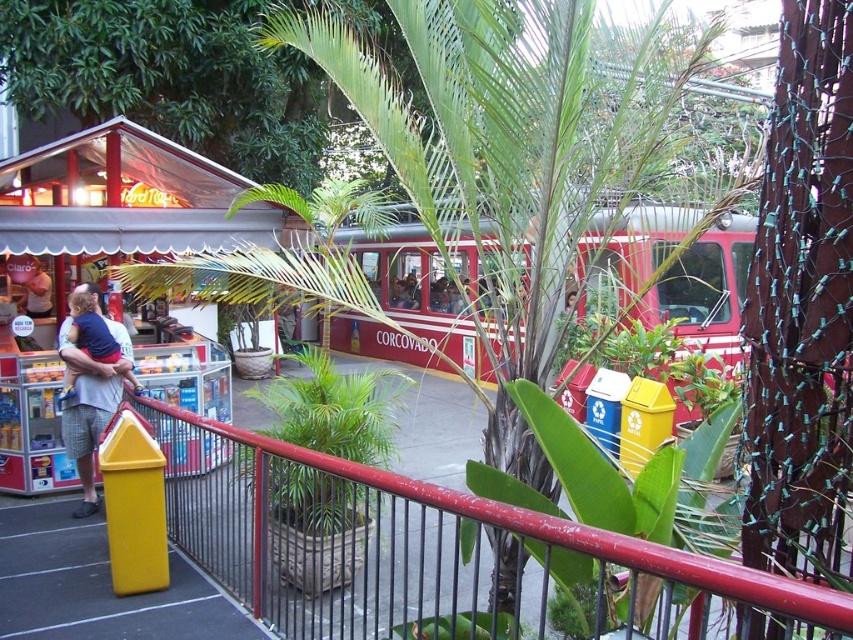
You are standing in the outdoor area and want to approach the kiosk. There is a metallic red railing at center and a matte blue shirt at left in your view. Which object is closer to you as you move forward?

The metallic red railing at center is closer to you because it is in front of the matte blue shirt at left.

You are a photographer trying to capture both the matte white shirt at left and the matte blue shirt at left in a single shot. Since the shirts are at the same location, which shirt would appear narrower in the photo?

The matte white shirt at left is thinner than the matte blue shirt at left, so it would appear narrower in the photo.

You are a tourist trying to reach the kiosk with the red and white striped awning. You see the metallic red railing at center and the matte blue shirt at left. Which object is wider when viewed from your current position?

The metallic red railing at center is wider than the matte blue shirt at left because its width surpasses the shirt.